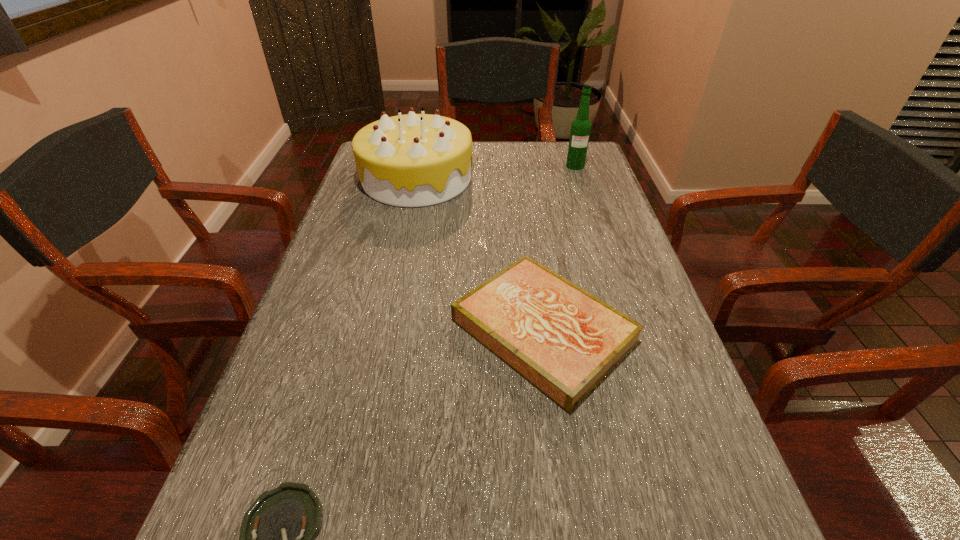
Where is `beer bottle positioned at the right edge`? The width and height of the screenshot is (960, 540). beer bottle positioned at the right edge is located at coordinates (581, 126).

The width and height of the screenshot is (960, 540). Find the location of `hardback book present at the right edge`. hardback book present at the right edge is located at coordinates (563, 340).

What are the coordinates of `object that is at the far left corner` in the screenshot? It's located at (414, 160).

At what (x,y) coordinates should I click in order to perform the action: click on object that is at the far right corner. Please return your answer as a coordinate pair (x, y). Looking at the image, I should click on pos(581,126).

Locate an element on the screen. The height and width of the screenshot is (540, 960). vacant area at the far edge of the desktop is located at coordinates (486, 172).

Locate an element on the screen. vacant position at the left edge of the desktop is located at coordinates (283, 423).

Locate an element on the screen. The width and height of the screenshot is (960, 540). vacant space at the right edge of the desktop is located at coordinates (627, 289).

This screenshot has height=540, width=960. I want to click on vacant area that lies between the third tallest object and the beer bottle, so click(559, 248).

Identify the location of free space between the second shortest object and the third shortest object. (480, 254).

Identify which object is the third nearest to the tallest object. Please provide its 2D coordinates. Your answer should be formatted as a tuple, i.e. [(x, y)], where the tuple contains the x and y coordinates of a point satisfying the conditions above.

[(277, 538)]